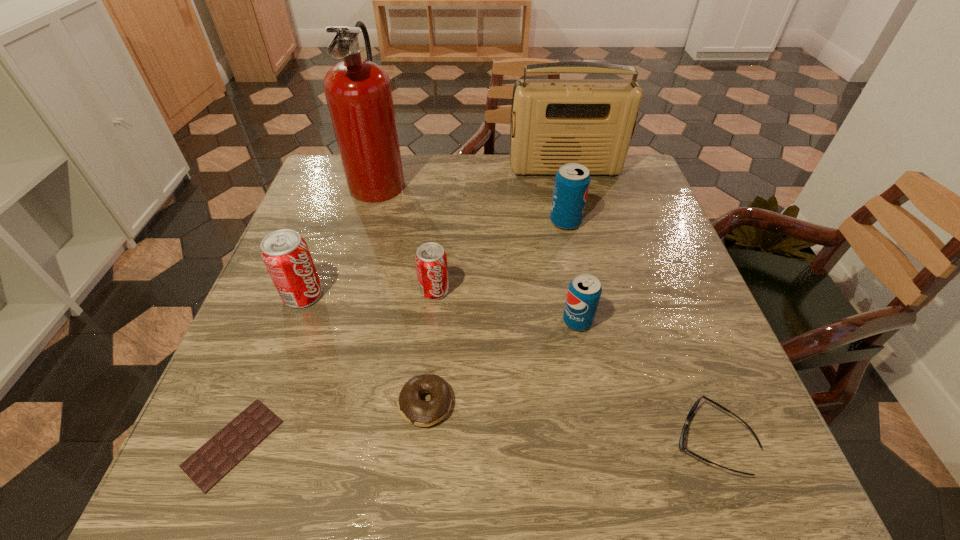
Locate an element on the screen. This screenshot has height=540, width=960. vacant region located on the front of the smaller blue soda can is located at coordinates point(595,411).

The width and height of the screenshot is (960, 540). I want to click on vacant area located 0.380m on the back of the doughnut, so click(441, 244).

The width and height of the screenshot is (960, 540). I want to click on vacant space located at the front of the blue sunglasses showing the lenses, so click(623, 440).

Identify the location of free location located at the front of the blue sunglasses showing the lenses. (575, 440).

The height and width of the screenshot is (540, 960). I want to click on vacant area situated at the front of the blue sunglasses showing the lenses, so click(479, 440).

I want to click on free space located 0.060m on the back of the shortest object, so click(262, 370).

Where is `fire extinguisher positioned at the far edge`? fire extinguisher positioned at the far edge is located at coordinates (358, 92).

Image resolution: width=960 pixels, height=540 pixels. What are the coordinates of `radio receiver at the far edge` in the screenshot? It's located at (591, 122).

At what (x,y) coordinates should I click in order to perform the action: click on sunglasses that is at the near edge. Please return your answer as a coordinate pair (x, y). Looking at the image, I should click on (681, 442).

Locate an element on the screen. Image resolution: width=960 pixels, height=540 pixels. chocolate bar that is at the near edge is located at coordinates (218, 456).